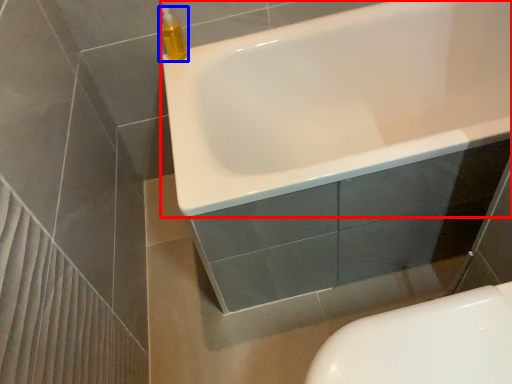
Question: Which object appears closest to the camera in this image, bathtub (highlighted by a red box) or cleaning product (highlighted by a blue box)?

Choices:
 (A) bathtub
 (B) cleaning product

Answer: (A)